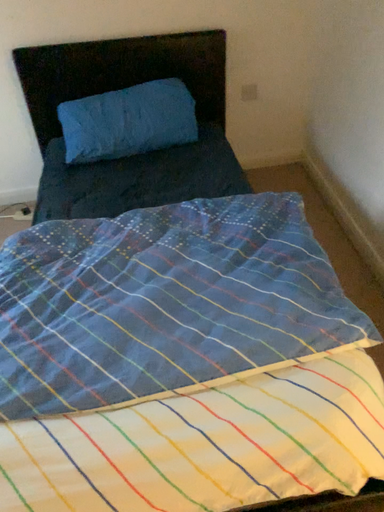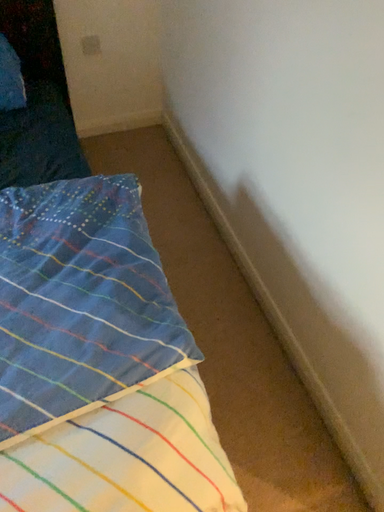
Question: Which way did the camera rotate in the video?

Choices:
 (A) rotated right
 (B) rotated left

Answer: (A)